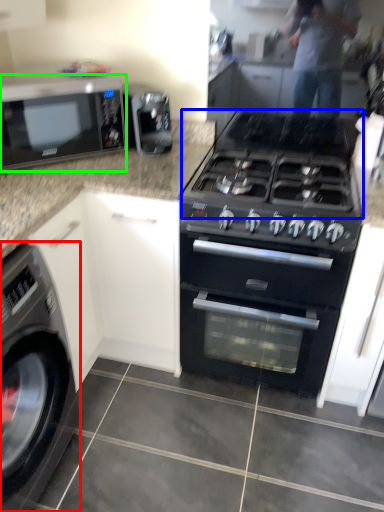
Question: Based on their relative distances, which object is farther from washing machine (highlighted by a red box)? Choose from gas stove (highlighted by a blue box) and microwave oven (highlighted by a green box).

Choices:
 (A) gas stove
 (B) microwave oven

Answer: (A)